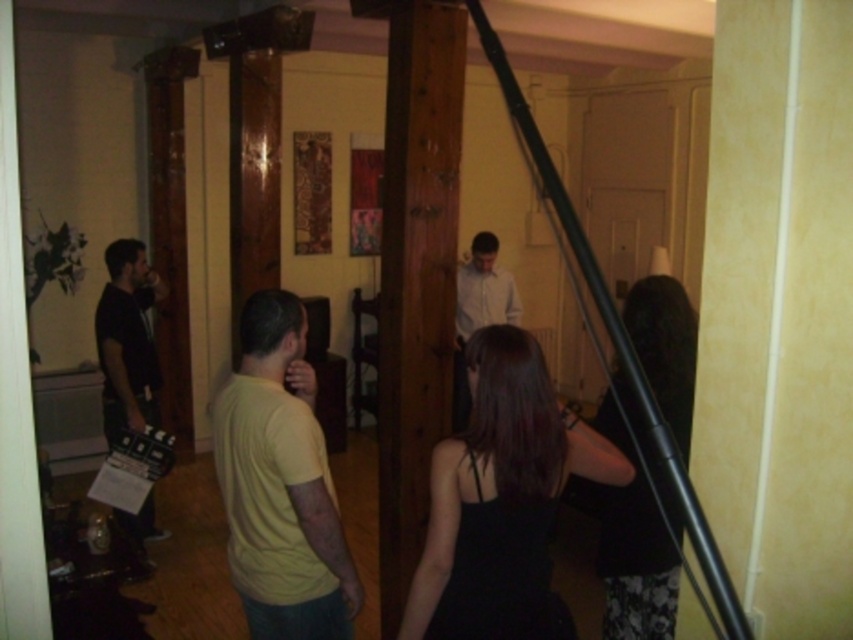
You are a photographer setting up for a photoshoot in this room. You need to position a large equipment box that requires 2 meters of space. The brown wood pillar at center and the black matte dress at lower right are in the way. Which object should you move to make space?

The brown wood pillar at center is bigger than the black matte dress at lower right, so you should move the brown wood pillar at center to make space for the equipment box.

In the scene shown: You are standing at point A located at coordinates point A at (x=264, y=376). You need to walk to point B which is 7.15 feet away. Is this distance within a typical room size?

The distance between point A at (x=264, y=376) and point B is 7.15 feet, which is reasonable for a typical room size, so yes, the distance is within a typical room size.

You are a film crew member who needs to move the matte black clapperboard at left closer to the black satin dress at center. How much distance do you need to cover to place them exactly 5 feet apart?

The current distance between the black satin dress at center and the matte black clapperboard at left is 8.20 feet. To make them 5 feet apart, you need to move the matte black clapperboard at left closer by 3.20 feet.